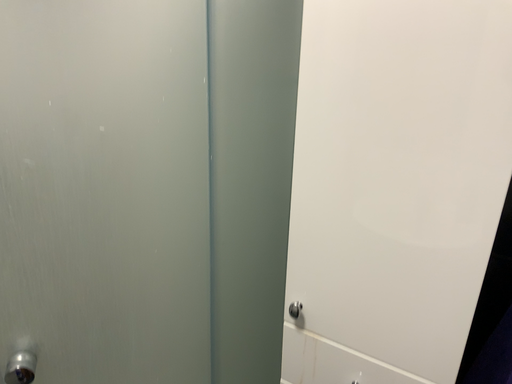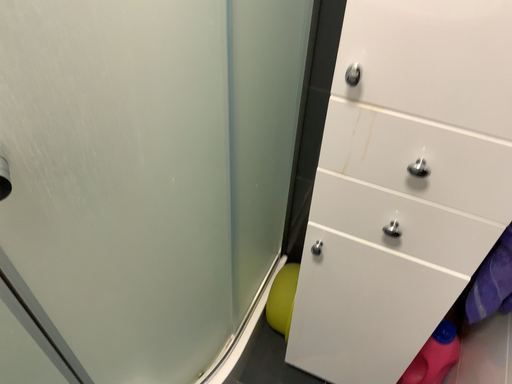
Question: Which way did the camera rotate in the video?

Choices:
 (A) rotated right
 (B) rotated left

Answer: (A)